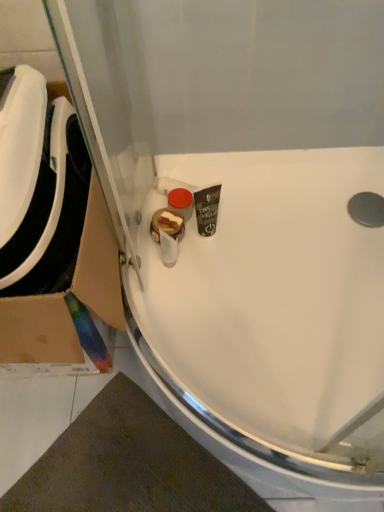
Question: Which direction should I rotate to look at white glossy sink at center, marked as the 2th sink in a left-to-right arrangement, — up or down?

Choices:
 (A) up
 (B) down

Answer: (B)

Question: Is white glossy sink at center, acting as the first sink starting from the right, far away from cardboard at left?

Choices:
 (A) yes
 (B) no

Answer: (B)

Question: Is white glossy sink at center, marked as the 2th sink in a left-to-right arrangement, behind cardboard at left?

Choices:
 (A) no
 (B) yes

Answer: (B)

Question: Can you confirm if white glossy sink at center, acting as the first sink starting from the right, is wider than cardboard at left?

Choices:
 (A) no
 (B) yes

Answer: (B)

Question: Does white glossy sink at center, acting as the first sink starting from the right, touch cardboard at left?

Choices:
 (A) no
 (B) yes

Answer: (A)

Question: Could you tell me if white glossy sink at center, acting as the first sink starting from the right, is facing cardboard at left?

Choices:
 (A) no
 (B) yes

Answer: (A)

Question: Considering the relative positions of white glossy sink at center, acting as the first sink starting from the right, and cardboard at left in the image provided, is white glossy sink at center, acting as the first sink starting from the right, to the left of cardboard at left from the viewer's perspective?

Choices:
 (A) no
 (B) yes

Answer: (A)

Question: Can you confirm if white glossy sink at left, arranged as the 1th sink when viewed from the left, is positioned to the right of cardboard at left?

Choices:
 (A) yes
 (B) no

Answer: (B)

Question: Is white glossy sink at left, which ranks as the 2th sink in right-to-left order, facing towards cardboard at left?

Choices:
 (A) no
 (B) yes

Answer: (B)

Question: Is white glossy sink at left, which ranks as the 2th sink in right-to-left order, thinner than cardboard at left?

Choices:
 (A) no
 (B) yes

Answer: (B)

Question: Does white glossy sink at left, arranged as the 1th sink when viewed from the left, have a greater height compared to cardboard at left?

Choices:
 (A) yes
 (B) no

Answer: (B)

Question: Does white glossy sink at left, which ranks as the 2th sink in right-to-left order, come in front of cardboard at left?

Choices:
 (A) yes
 (B) no

Answer: (A)

Question: From a real-world perspective, is white glossy sink at left, which ranks as the 2th sink in right-to-left order, on top of cardboard at left?

Choices:
 (A) no
 (B) yes

Answer: (B)

Question: From a real-world perspective, is cardboard at left on white glossy sink at center, marked as the 2th sink in a left-to-right arrangement?

Choices:
 (A) no
 (B) yes

Answer: (B)